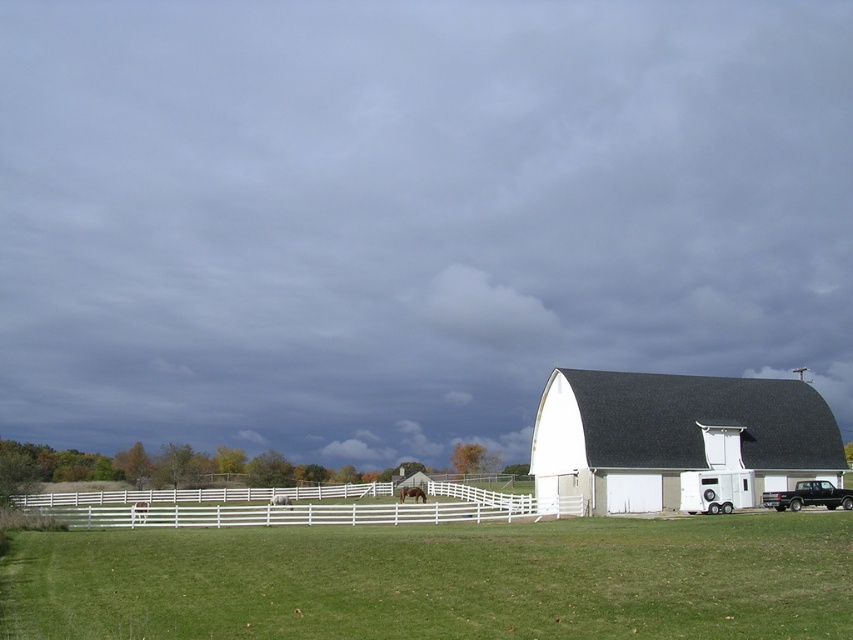
You are standing in the middle of the green field and want to reach both the point at coordinates point (x=289, y=525) and point (x=543, y=444). Which point will you reach first?

You will reach the point at coordinates point (x=289, y=525) first because it is closer to you than the point at coordinates point (x=543, y=444).

You are standing at the entrance of the farm and want to reach the white wooden fence at lower center. Which direction should you walk towards?

The white wooden fence at lower center is located at point 0.794 on the x axis and 0.341 on the y axis, so you should walk towards the lower center direction to reach it.

You are a farmer who needs to move the brown matte horse at center to the green grass at lower center. Given that your tractor can only tow a trailer for 30 meters before needing to refuel, how many times will you need to refuel during this task?

The distance between the green grass at lower center and the brown matte horse at center is 33.56 meters. Since the tractor can only tow for 30 meters before refueling, you would need to refuel once to complete the 33.56 meter journey.